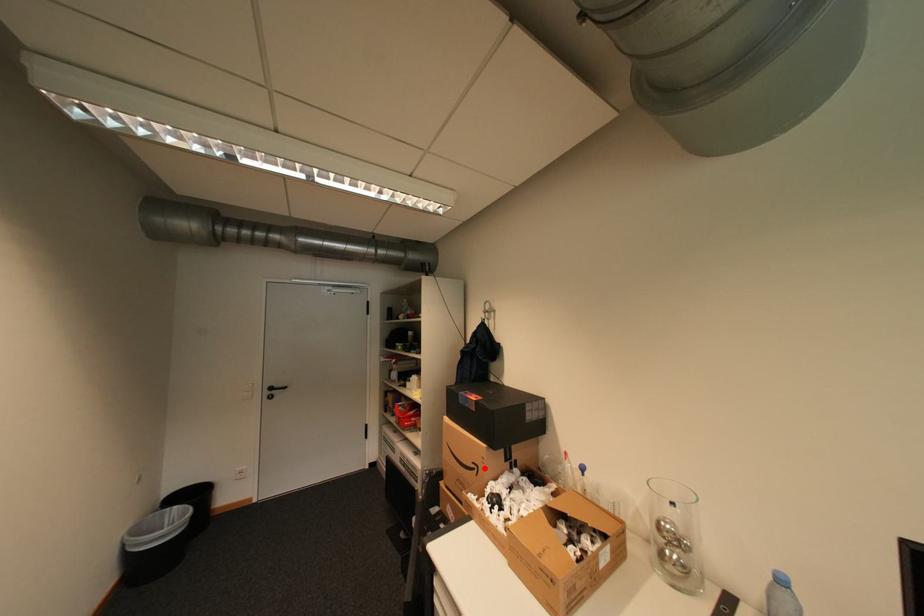
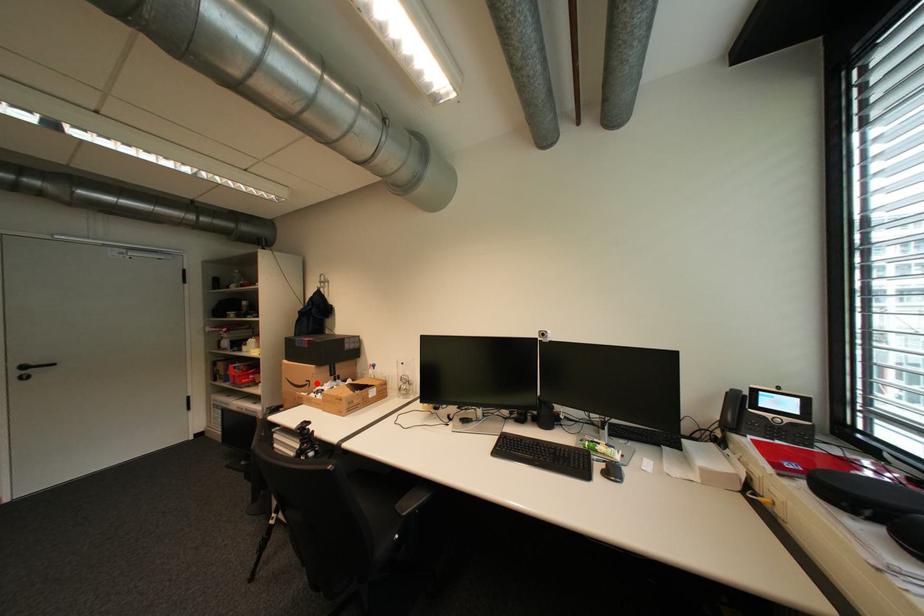
I am providing you with two images of the same scene from different viewpoints. A red point is marked on the first image and another point is marked on the second image. Are the points marked in image1 and image2 representing the same 3D position?

Yes